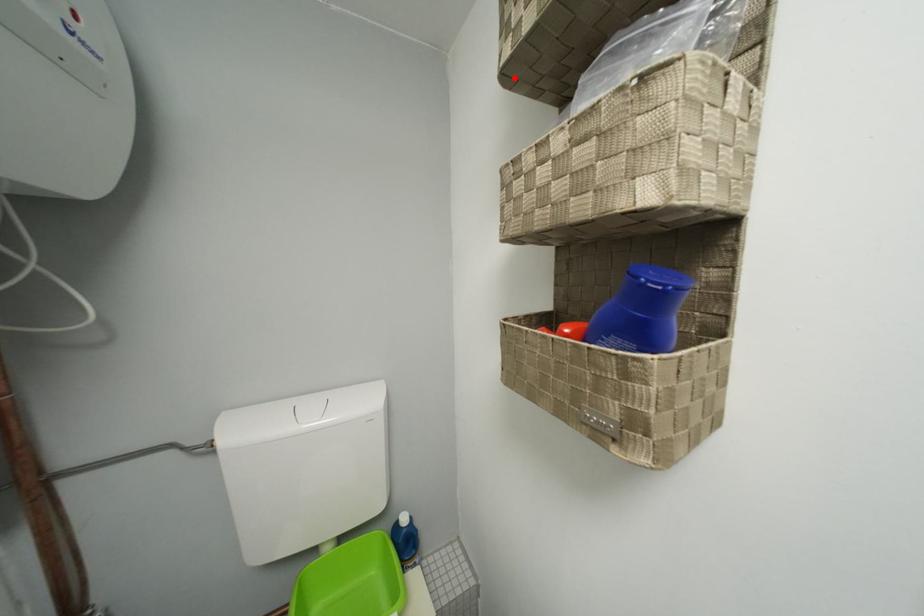
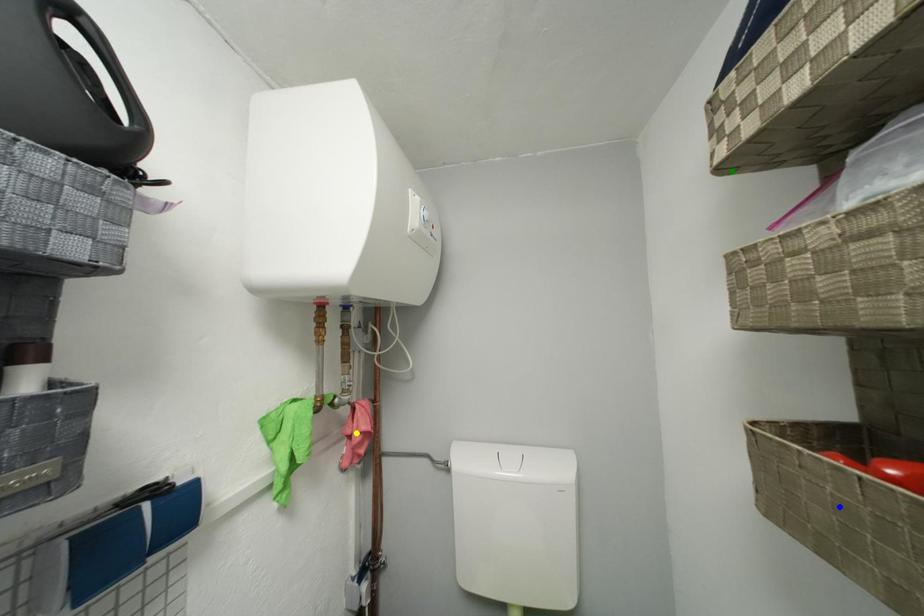
Question: I am providing you with two images of the same scene from different viewpoints. A red point is marked on the first image. You are given multiple points on the second image. In image 2, which mark is for the same physical point as the one in image 1?

Choices:
 (A) green point
 (B) blue point
 (C) yellow point

Answer: (A)